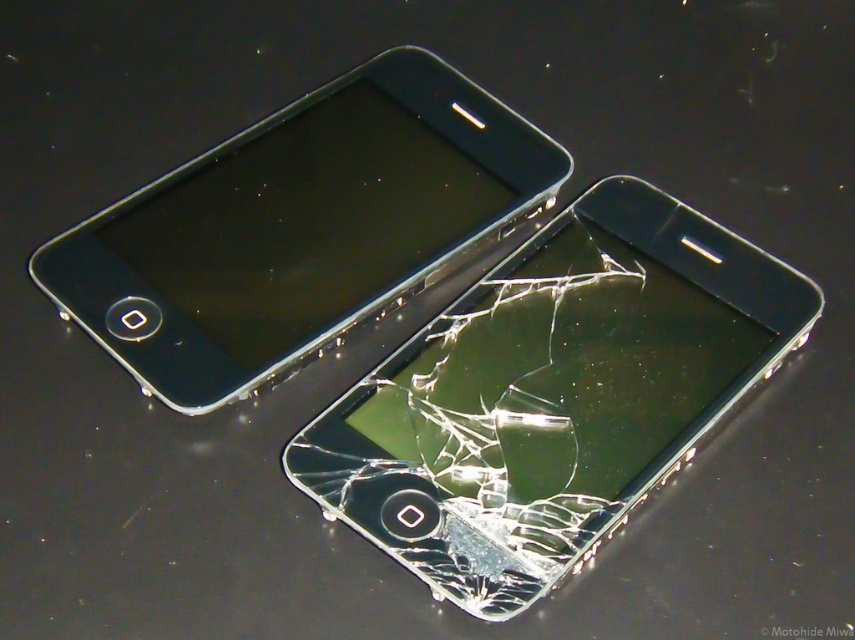
You are trying to determine which smartphone has a larger width. You have a transparent glass smartphone at center and a matte black smartphone at upper left in front of you. Which one is wider?

The matte black smartphone at upper left is wider than the transparent glass smartphone at center.

You are a delivery person who needs to place a third phone between the transparent glass smartphone at center and the matte black smartphone at upper left. The third phone is 4 inches wide. Can you fit it between them without overlapping either phone?

The distance between the transparent glass smartphone at center and the matte black smartphone at upper left is 7.83 inches. Since the third phone is 4 inches wide, there is enough space between them to fit the phone without overlapping either.

You are holding a ruler and want to measure the distance between the transparent glass smartphone at center and the camera. If the ruler is 12 inches long, how many rulers do you need to measure the distance?

The transparent glass smartphone at center is 4.10 feet away from the camera. Since 1 foot equals 12 inches, 4.10 feet is equivalent to 49.2 inches. Dividing 49.2 inches by 12 inches per ruler gives approximately 4.1 rulers needed.